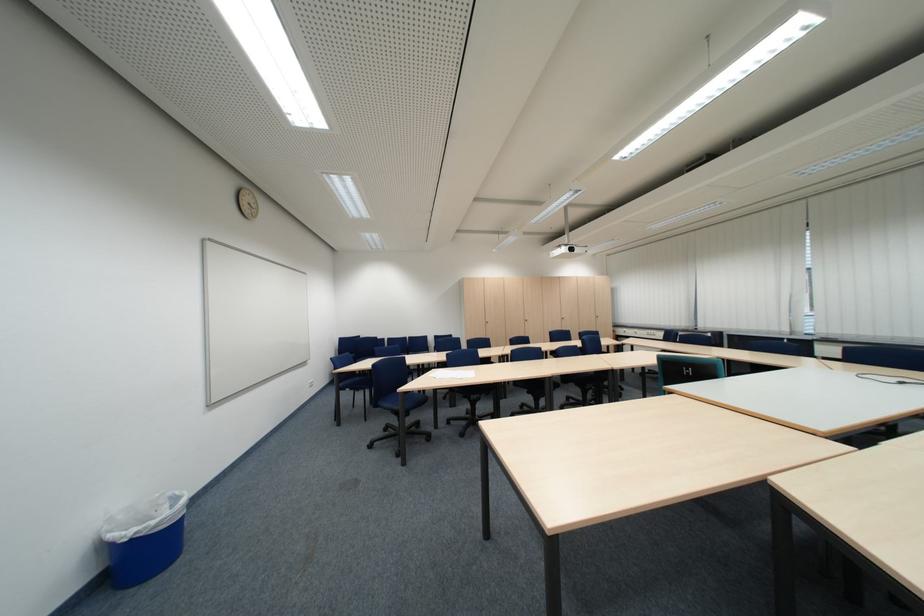
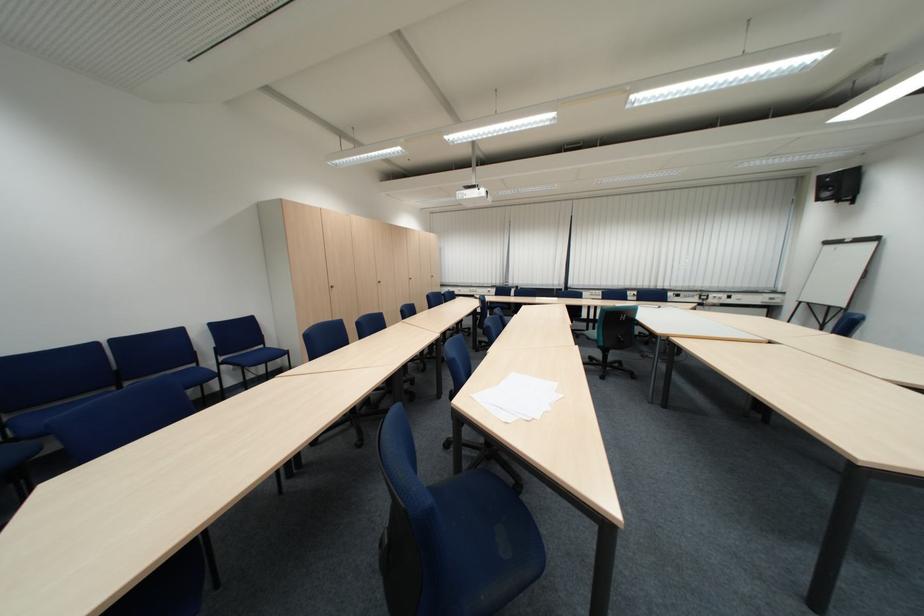
Question: I am providing you with two images of the same scene from different viewpoints. Which of the following objects are not visible in image2?

Choices:
 (A) stack of white papers
 (B) black folded chair
 (C) cabinet door handle
 (D) blue chair sitting surface

Answer: (D)